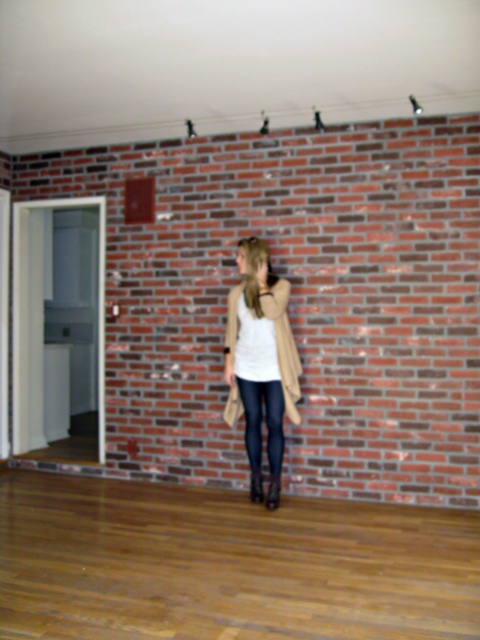
Question: Can you confirm if beige textured coat at center is positioned to the right of black leather leggings at center?

Choices:
 (A) no
 (B) yes

Answer: (A)

Question: Is beige textured coat at center closer to the viewer compared to black leather leggings at center?

Choices:
 (A) yes
 (B) no

Answer: (A)

Question: Does beige textured coat at center have a smaller size compared to black leather leggings at center?

Choices:
 (A) no
 (B) yes

Answer: (A)

Question: Which point is closer to the camera taking this photo?

Choices:
 (A) (278, 394)
 (B) (239, 403)

Answer: (A)